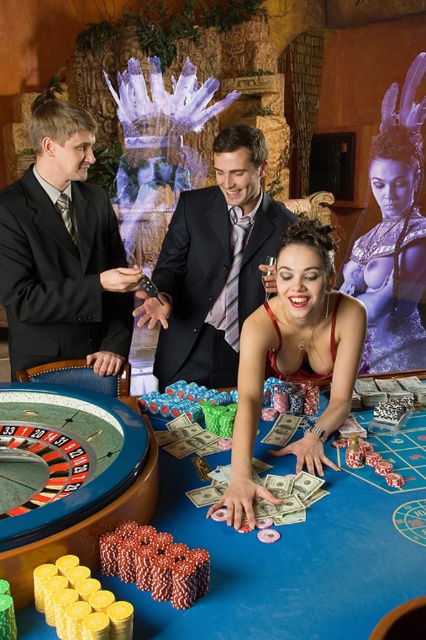
Who is positioned more to the left, blue felt table at center or black suit at center?

black suit at center

Does blue felt table at center have a lesser width compared to black suit at center?

No.

Is point (40, 618) less distant than point (51, 236)?

Yes, point (40, 618) is closer to viewer.

I want to click on blue felt table at center, so click(x=287, y=564).

Does black suit at center have a lesser width compared to shiny black suit at center?

Yes.

Between point (66, 259) and point (256, 264), which one is positioned behind?

Point (256, 264)

Find the location of a particular element. The image size is (426, 640). black suit at center is located at coordinates point(63,252).

Is shiny black suit at center wider than matte red dress at center?

Correct, the width of shiny black suit at center exceeds that of matte red dress at center.

Where is `shiny black suit at center`? Image resolution: width=426 pixels, height=640 pixels. shiny black suit at center is located at coordinates (215, 264).